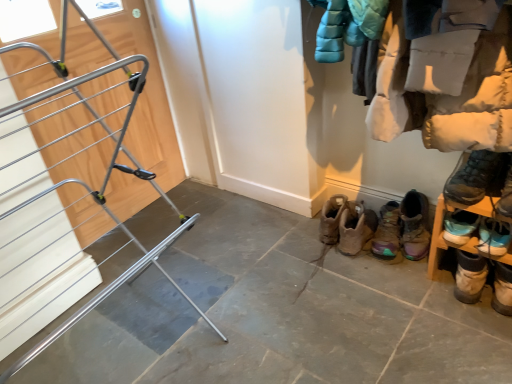
Identify the location of vacant space underneath silver metallic drying rack at left (from a real-world perspective). The width and height of the screenshot is (512, 384). (121, 351).